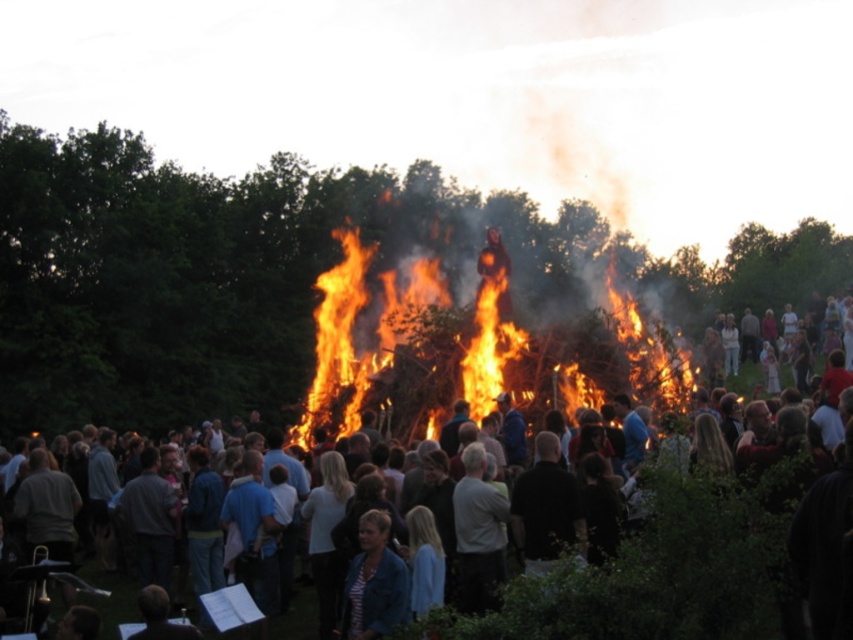
Question: Is dark clothing crowd at center above flaming wood at center?

Choices:
 (A) no
 (B) yes

Answer: (A)

Question: Which object is farther from the camera taking this photo?

Choices:
 (A) flaming wood at center
 (B) dark clothing crowd at center

Answer: (A)

Question: Is dark clothing crowd at center to the left of flaming wood at center from the viewer's perspective?

Choices:
 (A) no
 (B) yes

Answer: (A)

Question: Does dark clothing crowd at center appear on the right side of flaming wood at center?

Choices:
 (A) no
 (B) yes

Answer: (B)